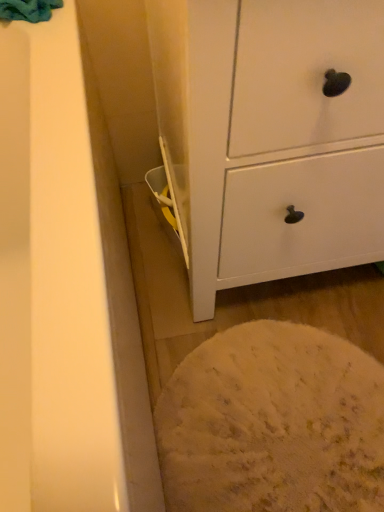
Question: Should I look upward or downward to see teal soft towel at upper left?

Choices:
 (A) down
 (B) up

Answer: (B)

Question: Could you tell me if teal soft towel at upper left is turned towards white matte chest of drawers at center?

Choices:
 (A) no
 (B) yes

Answer: (A)

Question: Is teal soft towel at upper left oriented away from white matte chest of drawers at center?

Choices:
 (A) no
 (B) yes

Answer: (A)

Question: Is teal soft towel at upper left not near white matte chest of drawers at center?

Choices:
 (A) yes
 (B) no

Answer: (B)

Question: Is teal soft towel at upper left thinner than white matte chest of drawers at center?

Choices:
 (A) no
 (B) yes

Answer: (B)

Question: Is teal soft towel at upper left bigger than white matte chest of drawers at center?

Choices:
 (A) no
 (B) yes

Answer: (A)

Question: From the image's perspective, is teal soft towel at upper left located above white matte chest of drawers at center?

Choices:
 (A) no
 (B) yes

Answer: (B)

Question: Is white matte chest of drawers at center placed right next to teal soft towel at upper left?

Choices:
 (A) no
 (B) yes

Answer: (A)

Question: Is white matte chest of drawers at center taller than teal soft towel at upper left?

Choices:
 (A) yes
 (B) no

Answer: (A)

Question: Does white matte chest of drawers at center have a greater width compared to teal soft towel at upper left?

Choices:
 (A) yes
 (B) no

Answer: (A)

Question: Is white matte chest of drawers at center not inside teal soft towel at upper left?

Choices:
 (A) yes
 (B) no

Answer: (A)

Question: Is teal soft towel at upper left at the back of white matte chest of drawers at center?

Choices:
 (A) yes
 (B) no

Answer: (B)

Question: Is white matte chest of drawers at center not close to teal soft towel at upper left?

Choices:
 (A) no
 (B) yes

Answer: (A)

Question: Would you say white matte chest of drawers at center is inside or outside teal soft towel at upper left?

Choices:
 (A) outside
 (B) inside

Answer: (A)